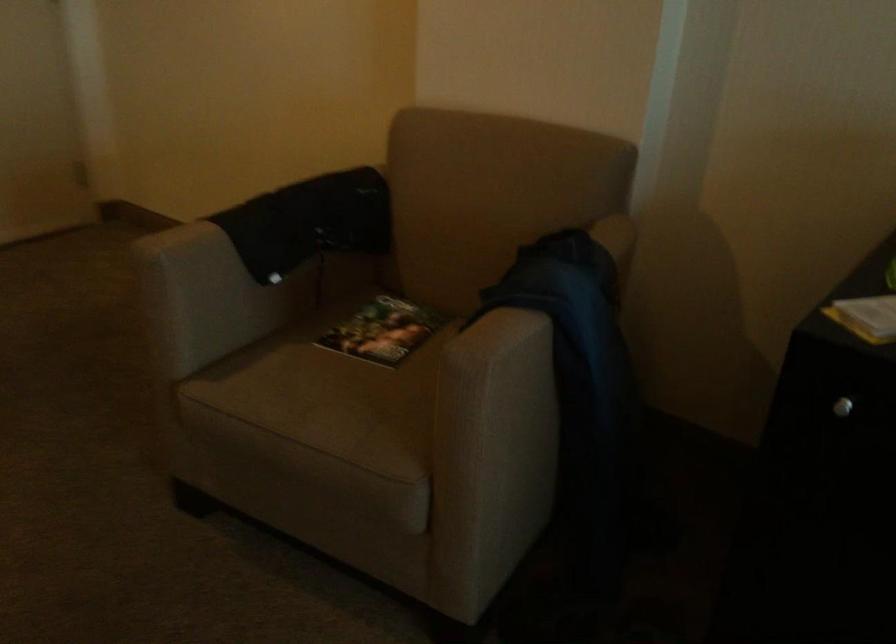
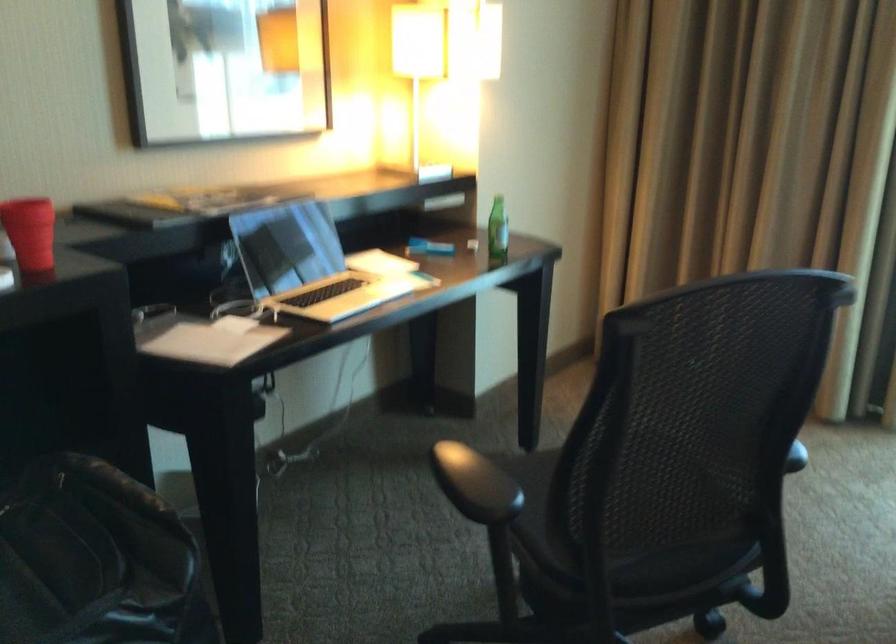
The first image is from the beginning of the video and the second image is from the end. How did the camera likely rotate when shooting the video?

The camera's rotation is toward right-down.